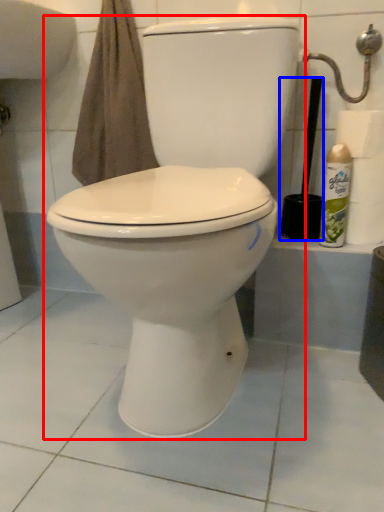
Question: Among these objects, which one is farthest to the camera, toilet (highlighted by a red box) or brush (highlighted by a blue box)?

Choices:
 (A) toilet
 (B) brush

Answer: (B)